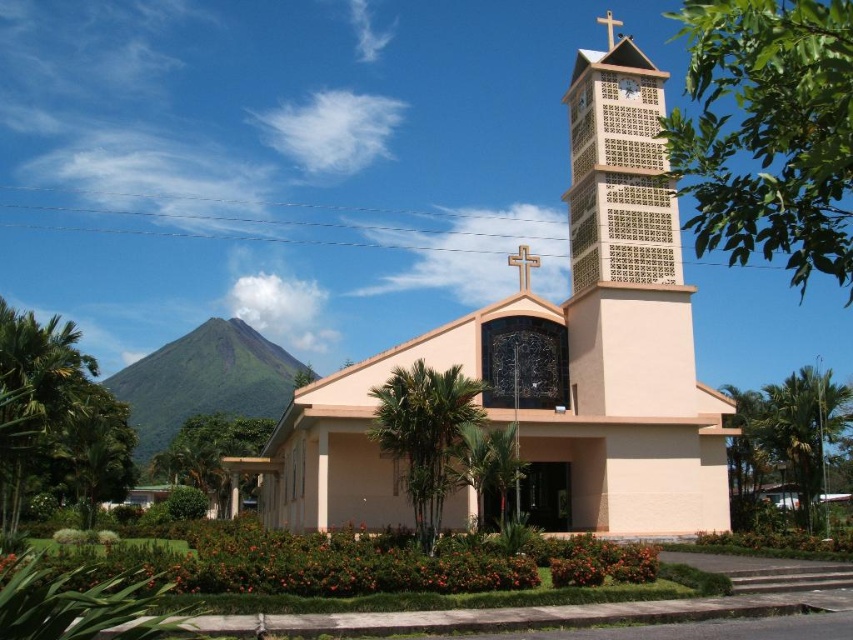
Question: Does beige concrete church at center appear under matte beige clock at upper center?

Choices:
 (A) yes
 (B) no

Answer: (A)

Question: Can you confirm if beige concrete church at center is positioned below beige lattice clock tower at center?

Choices:
 (A) yes
 (B) no

Answer: (A)

Question: Which object appears farthest from the camera in this image?

Choices:
 (A) matte beige clock at upper center
 (B) beige concrete church at center

Answer: (A)

Question: Observing the image, what is the correct spatial positioning of beige concrete church at center in reference to beige lattice clock tower at center?

Choices:
 (A) below
 (B) above

Answer: (A)

Question: Among these objects, which one is farthest from the camera?

Choices:
 (A) beige concrete church at center
 (B) matte beige clock at upper center

Answer: (B)

Question: Which point is closer to the camera?

Choices:
 (A) (637, 84)
 (B) (595, 186)

Answer: (B)